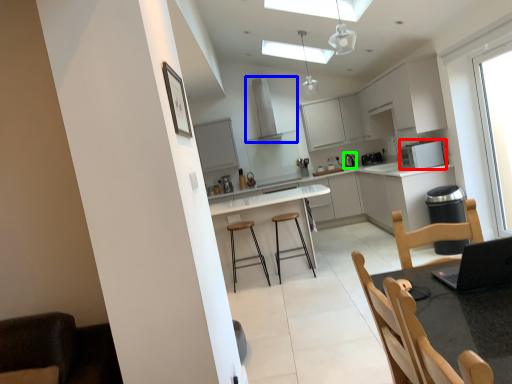
Question: Considering the real-world distances, which object is farthest from appliance (highlighted by a red box)? exhaust hood (highlighted by a blue box) or appliance (highlighted by a green box)?

Choices:
 (A) exhaust hood
 (B) appliance

Answer: (A)